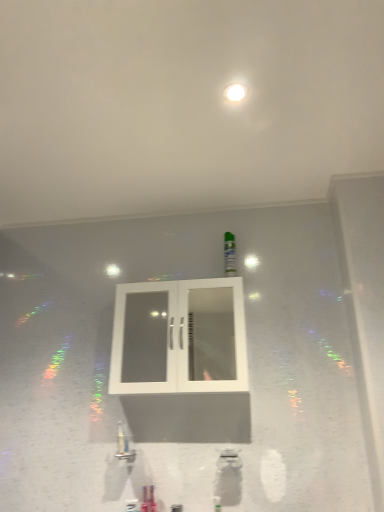
Question: Is white matte ceiling at upper center facing towards green matte bottle at center?

Choices:
 (A) yes
 (B) no

Answer: (B)

Question: From the image's perspective, is white matte ceiling at upper center above green matte bottle at center?

Choices:
 (A) yes
 (B) no

Answer: (A)

Question: From a real-world perspective, is white matte ceiling at upper center located beneath green matte bottle at center?

Choices:
 (A) no
 (B) yes

Answer: (A)

Question: Is white matte ceiling at upper center surrounding green matte bottle at center?

Choices:
 (A) yes
 (B) no

Answer: (B)

Question: Is white matte ceiling at upper center bigger than green matte bottle at center?

Choices:
 (A) no
 (B) yes

Answer: (B)

Question: From a real-world perspective, is white matte ceiling at upper center physically located above or below white glass cabinet at center?

Choices:
 (A) above
 (B) below

Answer: (A)

Question: Does point (147, 133) appear closer or farther from the camera than point (172, 364)?

Choices:
 (A) closer
 (B) farther

Answer: (A)

Question: From the image's perspective, is white matte ceiling at upper center located above or below white glass cabinet at center?

Choices:
 (A) below
 (B) above

Answer: (B)

Question: Considering the positions of white matte ceiling at upper center and white glass cabinet at center in the image, is white matte ceiling at upper center wider or thinner than white glass cabinet at center?

Choices:
 (A) wide
 (B) thin

Answer: (A)

Question: From a real-world perspective, is green matte bottle at center physically located above or below white matte ceiling at upper center?

Choices:
 (A) above
 (B) below

Answer: (B)

Question: Based on their positions, is green matte bottle at center located to the left or right of white matte ceiling at upper center?

Choices:
 (A) left
 (B) right

Answer: (B)

Question: From the image's perspective, is green matte bottle at center located above or below white matte ceiling at upper center?

Choices:
 (A) below
 (B) above

Answer: (A)

Question: Considering the positions of green matte bottle at center and white matte ceiling at upper center in the image, is green matte bottle at center bigger or smaller than white matte ceiling at upper center?

Choices:
 (A) small
 (B) big

Answer: (A)

Question: Considering the positions of green matte bottle at center and white glass cabinet at center in the image, is green matte bottle at center wider or thinner than white glass cabinet at center?

Choices:
 (A) wide
 (B) thin

Answer: (B)

Question: From the image's perspective, is green matte bottle at center located above or below white glass cabinet at center?

Choices:
 (A) above
 (B) below

Answer: (A)